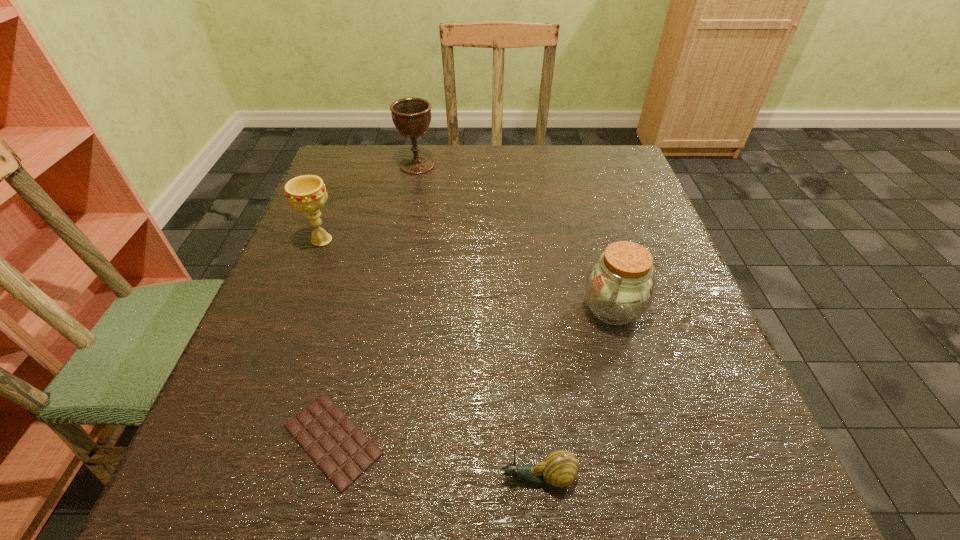
The height and width of the screenshot is (540, 960). What are the coordinates of `chocolate bar that is at the left edge` in the screenshot? It's located at (340, 449).

I want to click on object positioned at the right edge, so click(619, 287).

Find the location of a particular element. The height and width of the screenshot is (540, 960). object present at the near left corner is located at coordinates (340, 449).

You are a GUI agent. You are given a task and a screenshot of the screen. Output one action in this format:
    pyautogui.click(x=<x>, y=<y>)
    Task: Click on the blank space at the far edge of the desktop
    
    Given the screenshot: What is the action you would take?
    pyautogui.click(x=439, y=146)

You are a GUI agent. You are given a task and a screenshot of the screen. Output one action in this format:
    pyautogui.click(x=<x>, y=<y>)
    Task: Click on the free region at the near edge of the desktop
    
    Given the screenshot: What is the action you would take?
    pyautogui.click(x=438, y=484)

In the image, there is a desktop. In order to click on vacant area at the left edge in this screenshot , I will do `click(369, 234)`.

The image size is (960, 540). I want to click on free space at the right edge, so click(x=705, y=449).

Find the location of a particular element. free spot at the far left corner of the desktop is located at coordinates (383, 188).

This screenshot has width=960, height=540. In the image, there is a desktop. Find the location of `free space at the far right corner`. free space at the far right corner is located at coordinates (593, 174).

Where is `vacant area that lies between the chocolate bar and the second farthest object`? vacant area that lies between the chocolate bar and the second farthest object is located at coordinates (327, 340).